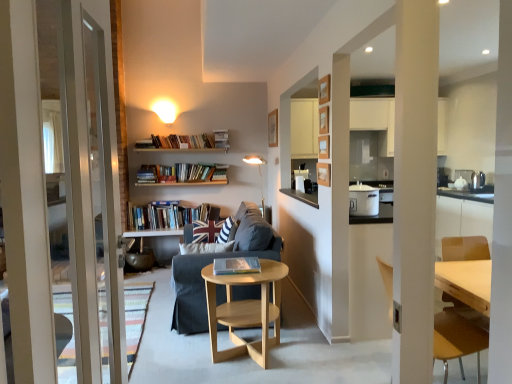
In order to click on free space above hardcover book at center, which appears as the first book when viewed from the right (from a real-world perspective) in this screenshot , I will do `click(233, 264)`.